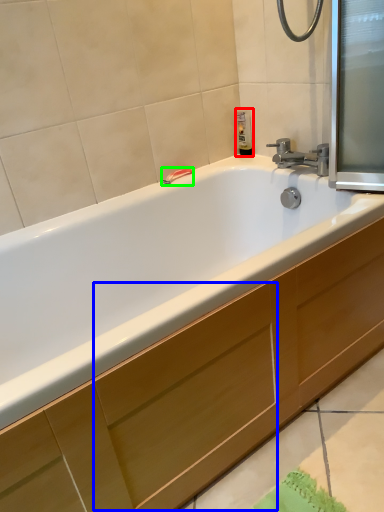
Question: Which object is the closest to the soap dispenser (highlighted by a red box)? Choose among these: drawer (highlighted by a blue box) or towel bar (highlighted by a green box).

Choices:
 (A) drawer
 (B) towel bar

Answer: (B)